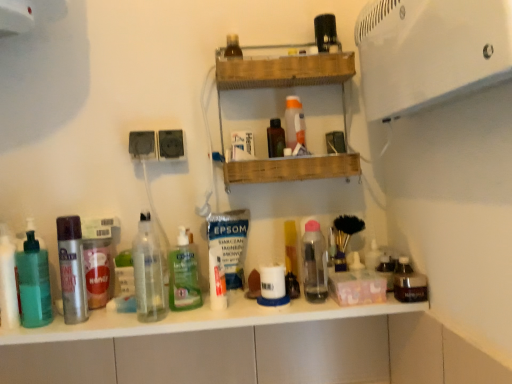
Locate an element on the screen. This screenshot has height=384, width=512. free location above white glossy counter top at center (from a real-world perspective) is located at coordinates (178, 310).